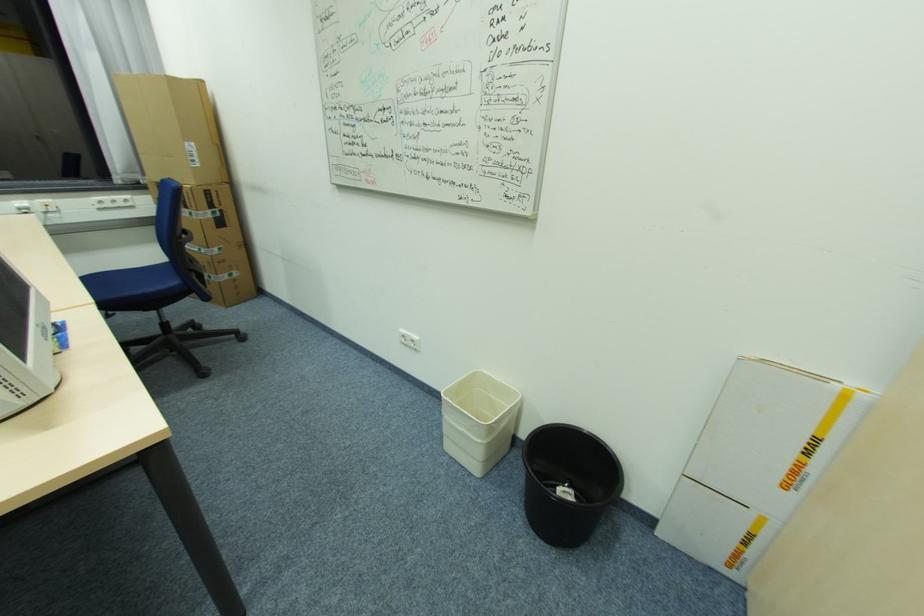
The height and width of the screenshot is (616, 924). What do you see at coordinates (129, 281) in the screenshot?
I see `the chair sitting surface` at bounding box center [129, 281].